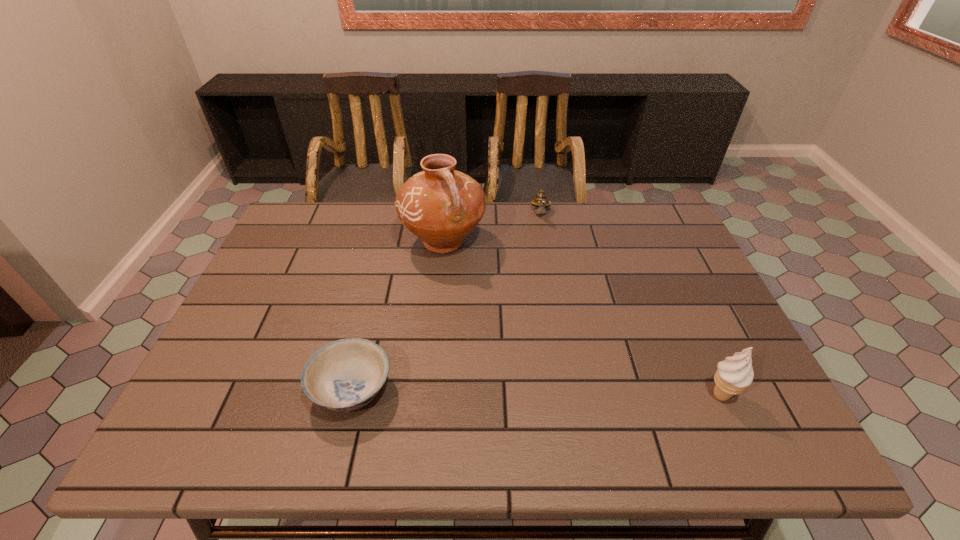
Where is `free area in between the second shortest object and the shortest object`? Image resolution: width=960 pixels, height=540 pixels. free area in between the second shortest object and the shortest object is located at coordinates (446, 301).

Find the location of a particular element. This screenshot has width=960, height=540. empty location between the icecream and the tallest object is located at coordinates (583, 319).

Identify the location of vacant area between the rightmost object and the snail. (632, 305).

The width and height of the screenshot is (960, 540). Find the location of `free space between the icecream and the snail`. free space between the icecream and the snail is located at coordinates (632, 305).

You are a GUI agent. You are given a task and a screenshot of the screen. Output one action in this format:
    pyautogui.click(x=<x>, y=<y>)
    Task: Click on the vacant region between the bowl and the second object from right to left
    The image size is (960, 540).
    Given the screenshot: What is the action you would take?
    pyautogui.click(x=446, y=301)

Locate an element on the screen. This screenshot has width=960, height=540. the closest object to the second object from right to left is located at coordinates (441, 206).

Find the location of `object that stands as the second closest to the tallest object`. object that stands as the second closest to the tallest object is located at coordinates (344, 375).

Find the location of `vacant area that satisfies the following two spatial constraints: 1. on the back side of the pottery; 2. on the right side of the bowl`. vacant area that satisfies the following two spatial constraints: 1. on the back side of the pottery; 2. on the right side of the bowl is located at coordinates (388, 242).

Where is `vacant position in the image that satisfies the following two spatial constraints: 1. on the back side of the bowl; 2. on the right side of the snail`? This screenshot has height=540, width=960. vacant position in the image that satisfies the following two spatial constraints: 1. on the back side of the bowl; 2. on the right side of the snail is located at coordinates (395, 214).

Identify the location of vacant point that satisfies the following two spatial constraints: 1. on the back side of the snail; 2. on the right side of the pottery. The width and height of the screenshot is (960, 540). click(446, 214).